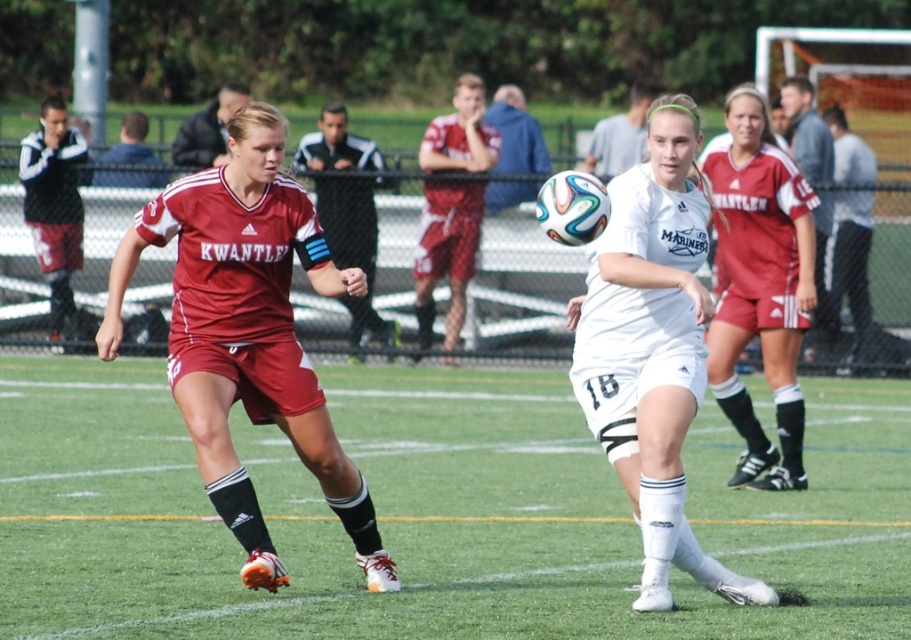
You are a soccer player positioned at the edge of the field. You need to kick the ball to the green grass at center and the matte red shorts at center. Which target is easier to reach based on their sizes?

The green grass at center has a larger size compared to the matte red shorts at center, so it is easier to reach.

You are a soccer referee observing the match. You notice the green grass at center and the matte red shorts at center. Which object is positioned lower in the image?

The green grass at center is located below the matte red shorts at center, so the green grass at center is positioned lower in the image.

You are a referee observing the soccer match. You need to determine if the ball is within the playing area. Based on the positions of the white matte soccer ball at center and the matte red shorts at center, can you confirm if the ball is inside the field boundaries?

The white matte soccer ball at center might be wider than matte red shorts at center, but this does not provide information about the ball being inside the field boundaries. The referee should check the ball position relative to the white boundary lines on the field.